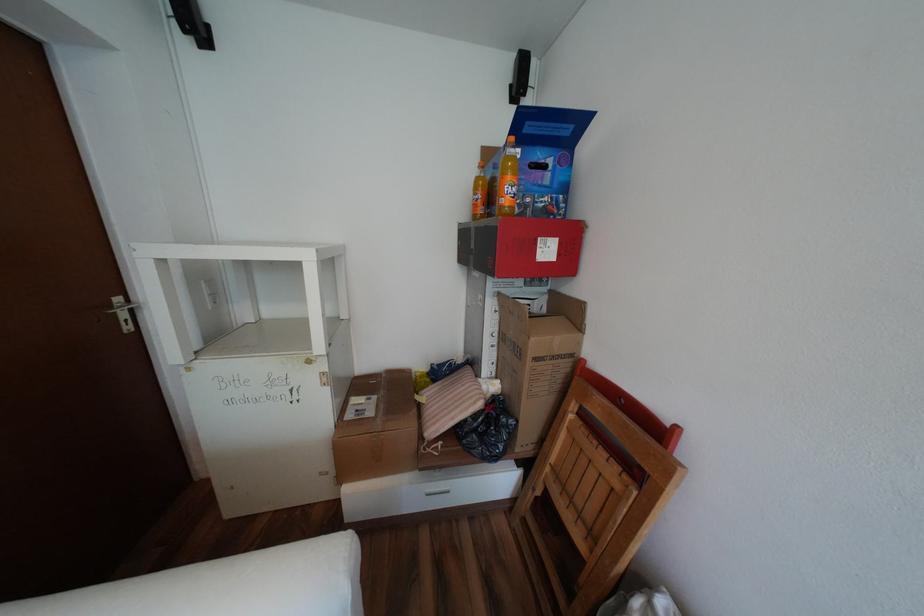
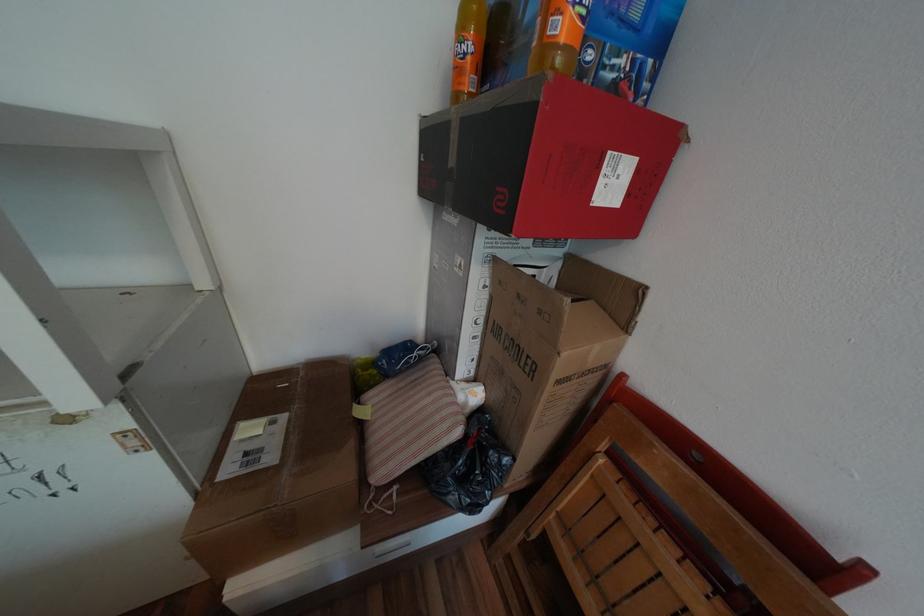
Locate, in the second image, the point that corresponds to point 548,251 in the first image.

(611, 182)